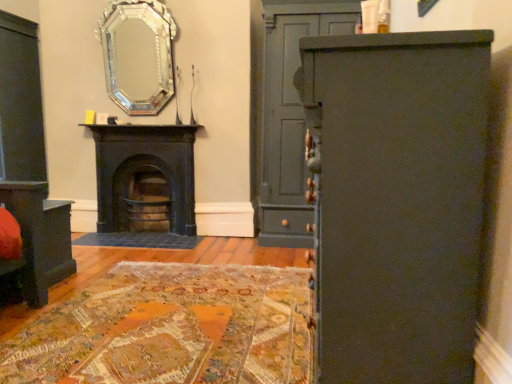
Question: Can you confirm if matte gray cabinet at right is positioned to the right of silver/glass mirror at upper center?

Choices:
 (A) yes
 (B) no

Answer: (A)

Question: Does matte gray cabinet at right have a larger size compared to silver/glass mirror at upper center?

Choices:
 (A) no
 (B) yes

Answer: (B)

Question: Can you confirm if matte gray cabinet at right is wider than silver/glass mirror at upper center?

Choices:
 (A) yes
 (B) no

Answer: (A)

Question: Does matte gray cabinet at right appear on the left side of silver/glass mirror at upper center?

Choices:
 (A) yes
 (B) no

Answer: (B)

Question: From a real-world perspective, does matte gray cabinet at right sit lower than silver/glass mirror at upper center?

Choices:
 (A) no
 (B) yes

Answer: (B)

Question: Does matte gray cabinet at right have a lesser width compared to silver/glass mirror at upper center?

Choices:
 (A) no
 (B) yes

Answer: (A)

Question: Can you confirm if matte black vanity at lower left is bigger than matte gray cabinet at right?

Choices:
 (A) no
 (B) yes

Answer: (A)

Question: Is matte black vanity at lower left not close to matte gray cabinet at right?

Choices:
 (A) no
 (B) yes

Answer: (B)

Question: From the image's perspective, is matte black vanity at lower left located beneath matte gray cabinet at right?

Choices:
 (A) no
 (B) yes

Answer: (B)

Question: Would you say matte gray cabinet at right is part of matte black vanity at lower left's contents?

Choices:
 (A) no
 (B) yes

Answer: (A)

Question: Is matte black vanity at lower left at the right side of matte gray cabinet at right?

Choices:
 (A) yes
 (B) no

Answer: (B)

Question: Does matte black vanity at lower left come behind matte gray cabinet at right?

Choices:
 (A) yes
 (B) no

Answer: (B)

Question: Is silver/glass mirror at upper center smaller than matte gray cabinet at right?

Choices:
 (A) no
 (B) yes

Answer: (B)